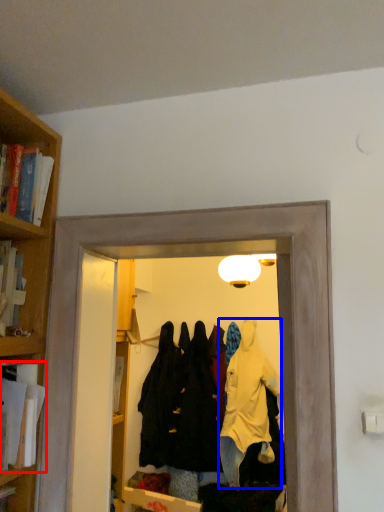
Question: Which object is further to the camera taking this photo, book (highlighted by a red box) or clothing (highlighted by a blue box)?

Choices:
 (A) book
 (B) clothing

Answer: (B)